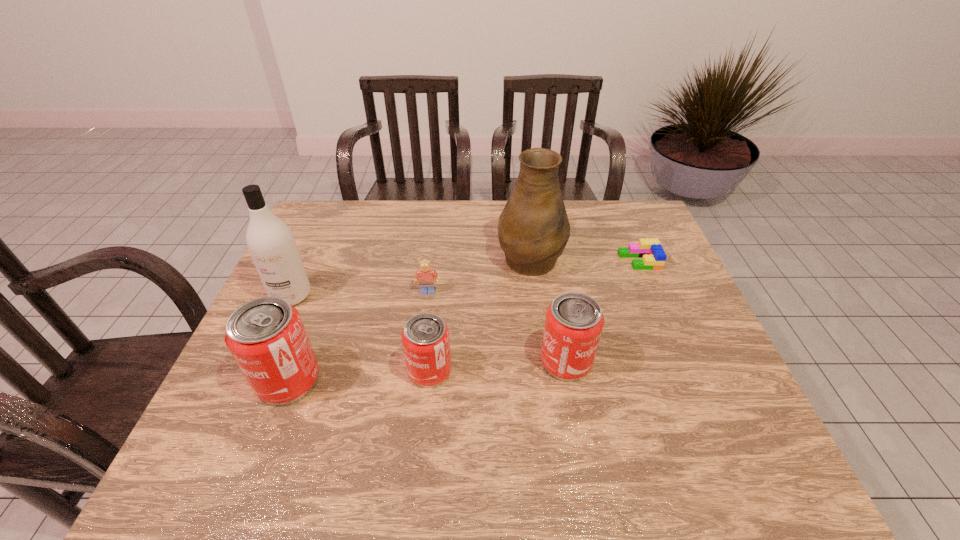
In order to click on object present at the far edge in this screenshot , I will do `click(533, 229)`.

The width and height of the screenshot is (960, 540). I want to click on object that is at the near edge, so click(x=266, y=336).

The width and height of the screenshot is (960, 540). In order to click on can that is positioned at the left edge in this screenshot , I will do `click(266, 336)`.

Locate an element on the screen. shampoo at the left edge is located at coordinates (271, 244).

Find the location of a particular element. The width and height of the screenshot is (960, 540). object situated at the right edge is located at coordinates (651, 251).

Locate an element on the screen. This screenshot has height=540, width=960. object that is at the near left corner is located at coordinates (266, 336).

You are a GUI agent. You are given a task and a screenshot of the screen. Output one action in this format:
    pyautogui.click(x=<x>, y=<y>)
    Task: Click on the free space at the far edge of the desktop
    
    Given the screenshot: What is the action you would take?
    pyautogui.click(x=451, y=210)

Locate an element on the screen. blank space at the near edge of the desktop is located at coordinates coord(644,424).

At what (x,y) coordinates should I click in order to perform the action: click on free space at the left edge of the desktop. Please return your answer as a coordinate pair (x, y). The height and width of the screenshot is (540, 960). Looking at the image, I should click on (318, 265).

This screenshot has width=960, height=540. Identify the location of vacant space at the far right corner of the desktop. [637, 210].